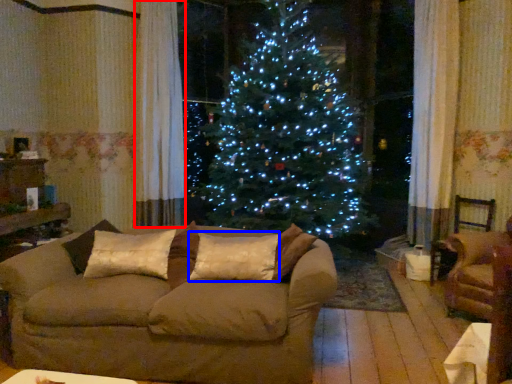
Question: Among these objects, which one is farthest to the camera, curtain (highlighted by a red box) or pillow (highlighted by a blue box)?

Choices:
 (A) curtain
 (B) pillow

Answer: (A)